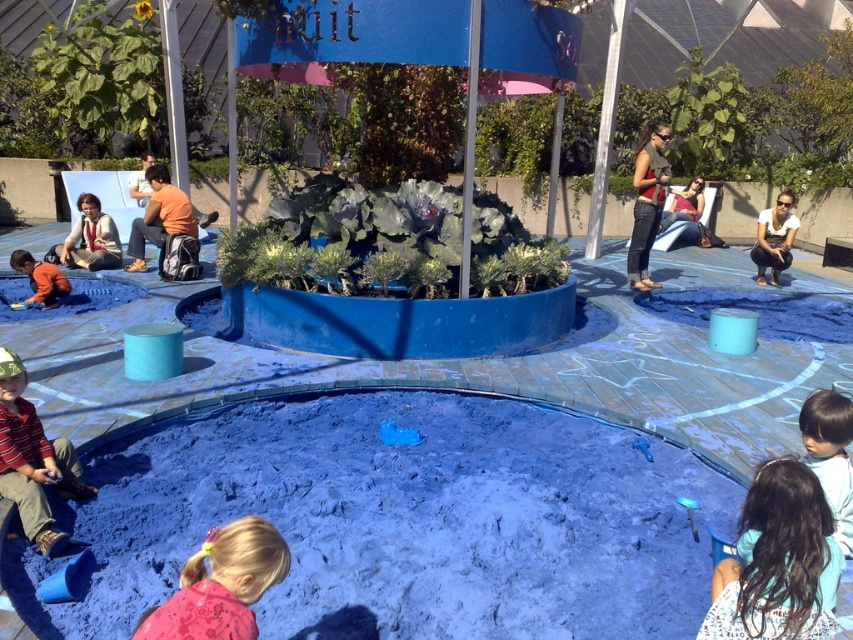
Question: Does dark brown hair at lower right appear on the right side of striped cotton shirt at lower left?

Choices:
 (A) yes
 (B) no

Answer: (A)

Question: Which point is farther to the camera?

Choices:
 (A) (146, 620)
 (B) (13, 259)
 (C) (755, 474)

Answer: (B)

Question: Is the position of dark brown hair at lower right less distant than that of striped cotton shirt at lower left?

Choices:
 (A) yes
 (B) no

Answer: (A)

Question: Among these points, which one is nearest to the camera?

Choices:
 (A) 735,612
 (B) 0,440
 (C) 61,291
 (D) 236,548

Answer: (D)

Question: Which of the following is the closest to the observer?

Choices:
 (A) (55, 276)
 (B) (801, 467)

Answer: (B)

Question: Does pink fabric at lower center come in front of matte orange shirt at lower left?

Choices:
 (A) yes
 (B) no

Answer: (A)